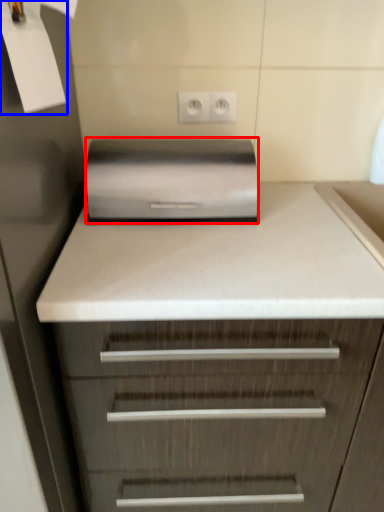
Question: Which of the following is the farthest to the observer, home appliance (highlighted by a red box) or paper (highlighted by a blue box)?

Choices:
 (A) home appliance
 (B) paper

Answer: (A)